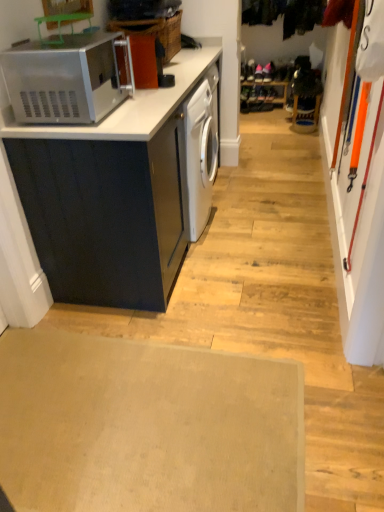
Question: Looking at their shapes, would you say beige carpet at lower center is wider or thinner than matte black cabinet at left?

Choices:
 (A) thin
 (B) wide

Answer: (B)

Question: Is beige carpet at lower center to the left or to the right of matte black cabinet at left in the image?

Choices:
 (A) left
 (B) right

Answer: (A)

Question: Which object is the farthest from the beige carpet at lower center?

Choices:
 (A) matte black cabinet at left
 (B) satin silver microwave at upper left

Answer: (B)

Question: Estimate the real-world distances between objects in this image. Which object is closer to the beige carpet at lower center?

Choices:
 (A) satin silver microwave at upper left
 (B) matte black cabinet at left

Answer: (B)